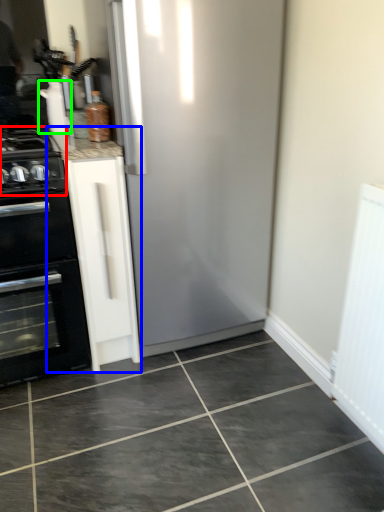
Question: Estimate the real-world distances between objects in this image. Which object is farther from gas stove (highlighted by a red box), cabinetry (highlighted by a blue box) or appliance (highlighted by a green box)?

Choices:
 (A) cabinetry
 (B) appliance

Answer: (B)